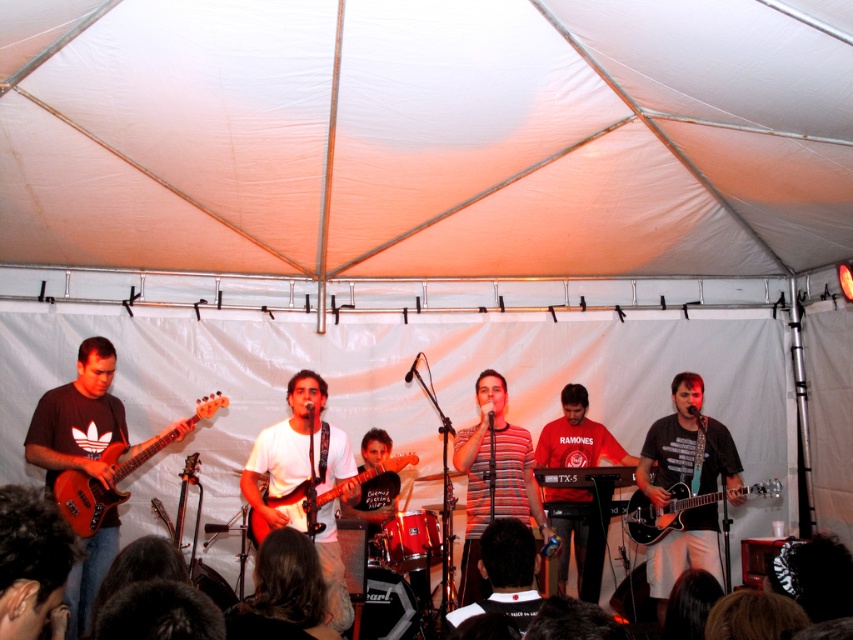
Question: Is matte black guitar at left in front of matte wood electric guitar at center?

Choices:
 (A) no
 (B) yes

Answer: (A)

Question: Which is nearer to the matte wood electric guitar at left?

Choices:
 (A) shiny black electric guitar at center
 (B) matte wood electric guitar at center
 (C) matte black guitar at left

Answer: (C)

Question: Is matte black guitar at left wider than matte wood electric guitar at center?

Choices:
 (A) no
 (B) yes

Answer: (A)

Question: Estimate the real-world distances between objects in this image. Which object is closer to the matte wood electric guitar at center?

Choices:
 (A) matte black guitar at left
 (B) matte wood electric guitar at left
 (C) shiny black electric guitar at center

Answer: (B)

Question: Which object appears closest to the camera in this image?

Choices:
 (A) matte black guitar at left
 (B) matte wood electric guitar at left

Answer: (B)

Question: Is matte wood electric guitar at left wider than shiny black electric guitar at center?

Choices:
 (A) no
 (B) yes

Answer: (A)